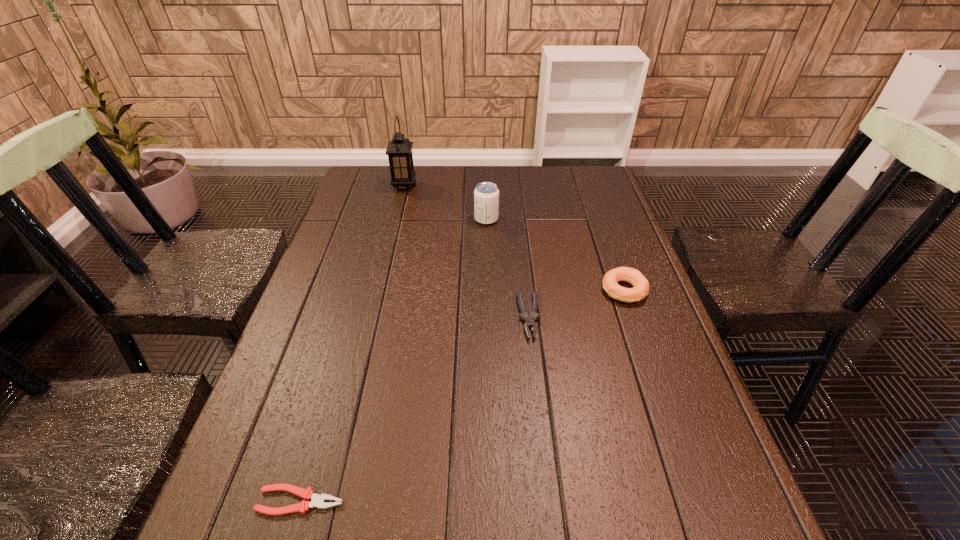
Locate an element on the screen. free space at the far edge of the desktop is located at coordinates (434, 179).

Image resolution: width=960 pixels, height=540 pixels. I want to click on vacant space at the near edge of the desktop, so (507, 539).

Image resolution: width=960 pixels, height=540 pixels. In the image, there is a desktop. Identify the location of free space at the left edge. (329, 260).

The height and width of the screenshot is (540, 960). I want to click on vacant space at the right edge, so click(632, 320).

This screenshot has height=540, width=960. In the image, there is a desktop. Identify the location of vacant space at the far left corner. (383, 183).

Identify the location of vacant space at the far right corner of the desktop. The height and width of the screenshot is (540, 960). (568, 174).

At what (x,y) coordinates should I click in order to perform the action: click on blank region between the shortest object and the rightmost object. Please return your answer as a coordinate pair (x, y). The height and width of the screenshot is (540, 960). Looking at the image, I should click on (462, 395).

Where is `free space between the shorter pliers and the farthest object`? This screenshot has height=540, width=960. free space between the shorter pliers and the farthest object is located at coordinates (352, 343).

Identify the location of empty space that is in between the right pliers and the soda can. Image resolution: width=960 pixels, height=540 pixels. (508, 268).

Find the location of a particular element. The height and width of the screenshot is (540, 960). vacant area that lies between the soda can and the right pliers is located at coordinates (508, 268).